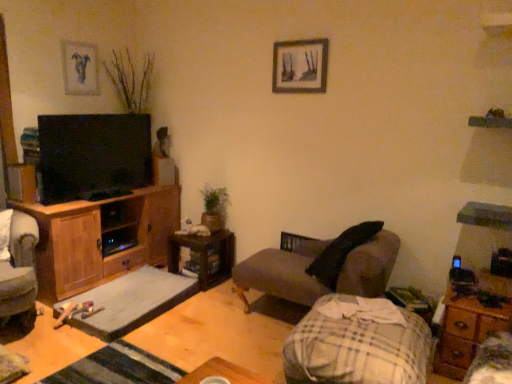
Question: Considering the relative sizes of green matte plant at center and matte blue painting at upper left, which appears as the 2th picture frame when viewed from the front, in the image provided, is green matte plant at center taller than matte blue painting at upper left, which appears as the 2th picture frame when viewed from the front,?

Choices:
 (A) no
 (B) yes

Answer: (A)

Question: Considering the relative sizes of green matte plant at center and matte blue painting at upper left, the second picture frame viewed from the right, in the image provided, is green matte plant at center thinner than matte blue painting at upper left, the second picture frame viewed from the right,?

Choices:
 (A) yes
 (B) no

Answer: (B)

Question: Is green matte plant at center behind matte blue painting at upper left, the first picture frame when ordered from back to front?

Choices:
 (A) no
 (B) yes

Answer: (B)

Question: Is green matte plant at center with matte blue painting at upper left, the first picture frame when ordered from back to front?

Choices:
 (A) yes
 (B) no

Answer: (B)

Question: Does green matte plant at center lie in front of matte blue painting at upper left, which appears as the 2th picture frame when viewed from the front?

Choices:
 (A) no
 (B) yes

Answer: (A)

Question: Is plaid fabric blanket at lower right taller or shorter than dark gray fabric couch at center?

Choices:
 (A) tall
 (B) short

Answer: (B)

Question: Is point (342, 382) closer or farther from the camera than point (307, 296)?

Choices:
 (A) closer
 (B) farther

Answer: (A)

Question: Considering their positions, is plaid fabric blanket at lower right located in front of or behind dark gray fabric couch at center?

Choices:
 (A) behind
 (B) front

Answer: (B)

Question: From a real-world perspective, relative to dark gray fabric couch at center, is plaid fabric blanket at lower right vertically above or below?

Choices:
 (A) below
 (B) above

Answer: (A)

Question: From a real-world perspective, is wooden cabinet at left above or below gray fabric footrest at lower center?

Choices:
 (A) below
 (B) above

Answer: (B)

Question: From the image's perspective, is wooden cabinet at left located above or below gray fabric footrest at lower center?

Choices:
 (A) above
 (B) below

Answer: (A)

Question: Is wooden cabinet at left in front of or behind gray fabric footrest at lower center in the image?

Choices:
 (A) behind
 (B) front

Answer: (A)

Question: In terms of size, does wooden cabinet at left appear bigger or smaller than gray fabric footrest at lower center?

Choices:
 (A) big
 (B) small

Answer: (A)

Question: In terms of height, does wooden cabinet at left look taller or shorter compared to wooden nightstand at lower right?

Choices:
 (A) tall
 (B) short

Answer: (A)

Question: In the image, is wooden cabinet at left on the left side or the right side of wooden nightstand at lower right?

Choices:
 (A) left
 (B) right

Answer: (A)